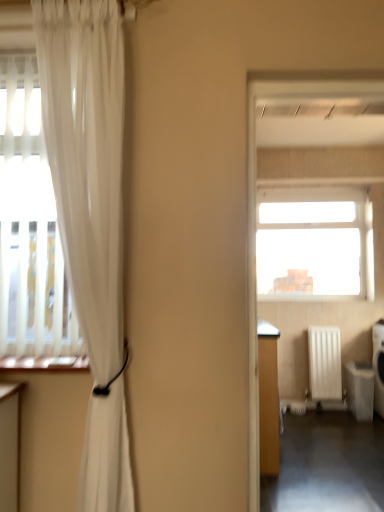
Question: In terms of width, does white plastic dishwasher at lower right look wider or thinner when compared to transparent glass window at upper center?

Choices:
 (A) thin
 (B) wide

Answer: (B)

Question: Which is correct: white plastic dishwasher at lower right is inside transparent glass window at upper center, or outside of it?

Choices:
 (A) outside
 (B) inside

Answer: (A)

Question: Based on their relative distances, which object is farther from the transparent glass window at upper center?

Choices:
 (A) white plastic dishwasher at lower right
 (B) white matte radiator at right
 (C) dark gray concrete corridor at lower right
 (D) translucent white curtain at left

Answer: (D)

Question: Estimate the real-world distances between objects in this image. Which object is closer to the white matte radiator at right?

Choices:
 (A) white plastic dishwasher at lower right
 (B) dark gray concrete corridor at lower right
 (C) transparent glass window at upper center
 (D) translucent white curtain at left

Answer: (A)